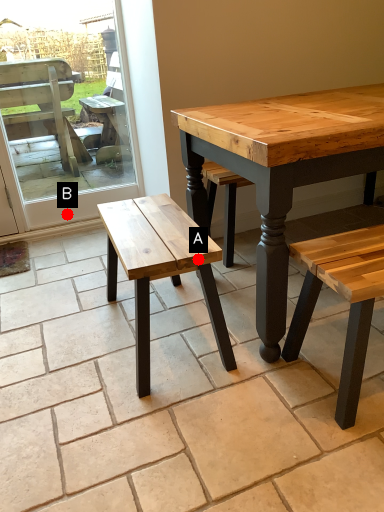
Question: Two points are circled on the image, labeled by A and B beside each circle. Which point is farther to the camera?

Choices:
 (A) A is further
 (B) B is further

Answer: (B)